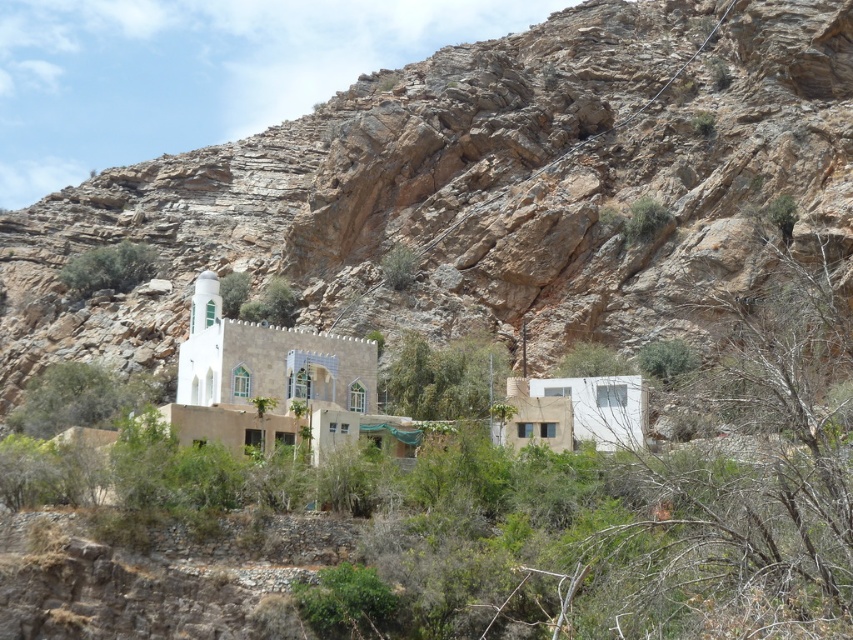
Can you confirm if white stone church at center is positioned below green leafy shrub at upper center?

Indeed, white stone church at center is positioned under green leafy shrub at upper center.

Who is more forward, [375,429] or [83,253]?

Point [375,429]

What are the coordinates of `white stone church at center` in the screenshot? It's located at (277, 385).

Which of these two, green leafy bush at lower left or green leafy shrub at upper center, stands shorter?

green leafy bush at lower left

The width and height of the screenshot is (853, 640). Identify the location of green leafy bush at lower left. (82, 397).

The image size is (853, 640). What are the coordinates of `green leafy bush at lower left` in the screenshot? It's located at (82, 397).

Who is lower down, brown rocky mountain at center or white stone church at center?

Positioned lower is white stone church at center.

Who is shorter, brown rocky mountain at center or white stone church at center?

white stone church at center

Does point (635, 330) come behind point (200, 294)?

That is True.

Locate an element on the screen. The width and height of the screenshot is (853, 640). brown rocky mountain at center is located at coordinates (480, 189).